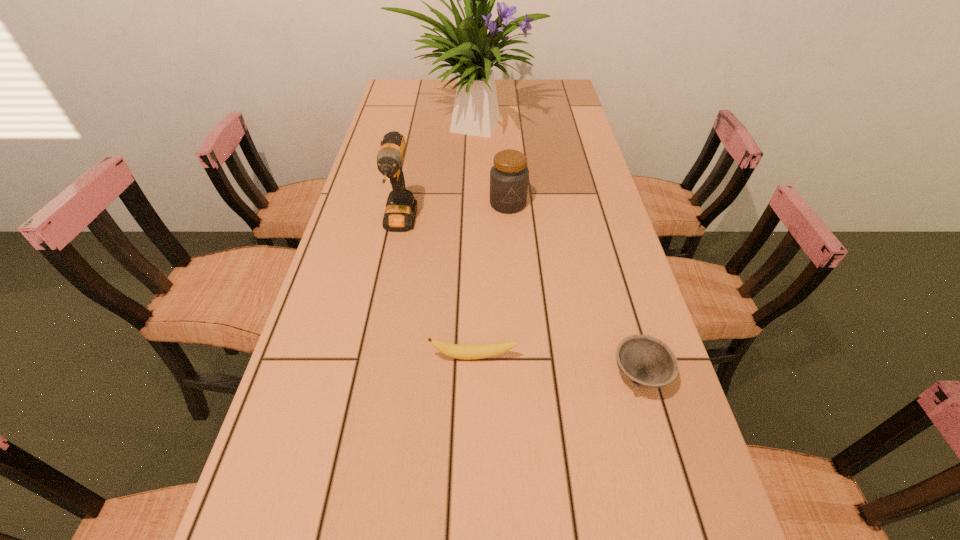
At what (x,y) coordinates should I click in order to perform the action: click on vacant space at the right edge of the desktop. Please return your answer as a coordinate pair (x, y). Image resolution: width=960 pixels, height=540 pixels. Looking at the image, I should click on (618, 434).

This screenshot has height=540, width=960. Find the location of `vacant space at the far left corner of the desktop`. vacant space at the far left corner of the desktop is located at coordinates (419, 94).

Locate an element on the screen. The width and height of the screenshot is (960, 540). vacant area that lies between the tallest object and the rightmost object is located at coordinates (555, 250).

Identify the location of free area in between the bowl and the banana. (557, 366).

Where is `free point between the rightmost object and the banana`? The height and width of the screenshot is (540, 960). free point between the rightmost object and the banana is located at coordinates (557, 366).

Identify the location of free space that is in between the farthest object and the rightmost object. (555, 250).

Locate an element on the screen. empty space between the third shortest object and the banana is located at coordinates (492, 280).

At what (x,y) coordinates should I click in order to perform the action: click on free space between the tallest object and the rightmost object. Please return your answer as a coordinate pair (x, y). Looking at the image, I should click on (x=555, y=250).

Find the location of a particular element. vacant point located between the flower arrangement and the drill is located at coordinates (435, 175).

At what (x,y) coordinates should I click in order to perform the action: click on free spot between the rightmost object and the drill. Please return your answer as a coordinate pair (x, y). This screenshot has width=960, height=540. Looking at the image, I should click on (519, 300).